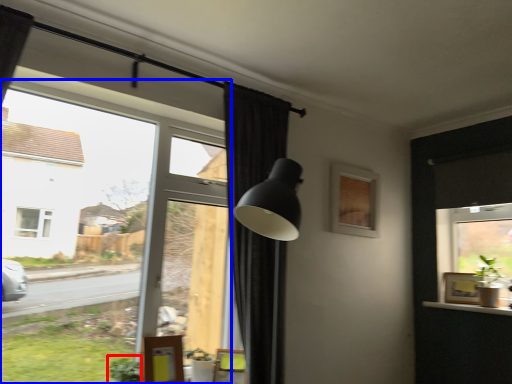
Question: Which of the following is the closest to the observer, plant (highlighted by a red box) or window (highlighted by a blue box)?

Choices:
 (A) plant
 (B) window

Answer: (B)